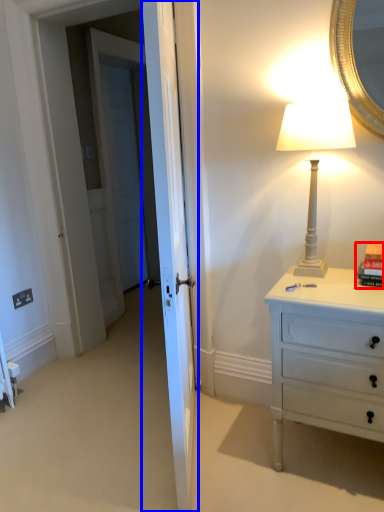
Question: Which of the following is the farthest to the observer, book (highlighted by a red box) or door (highlighted by a blue box)?

Choices:
 (A) book
 (B) door

Answer: (A)